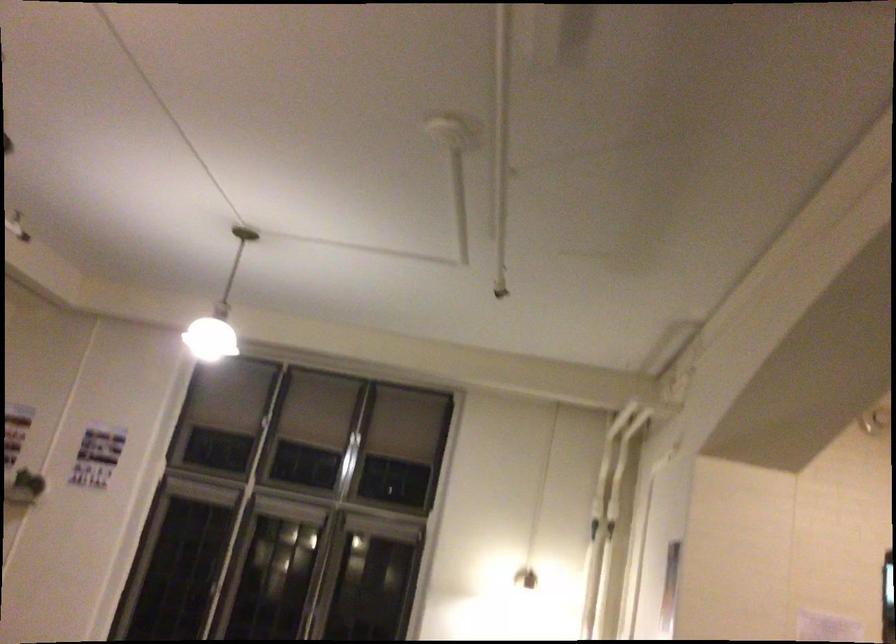
The width and height of the screenshot is (896, 644). I want to click on window latch handle, so [x=355, y=437].